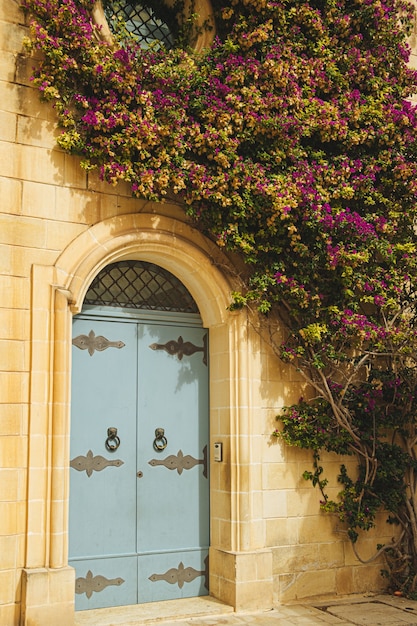
You are a GUI agent. You are given a task and a screenshot of the screen. Output one action in this format:
    pyautogui.click(x=<x>, y=<y>)
    Task: Click on the right of doorway arch
    
    Given the screenshot: What is the action you would take?
    pyautogui.click(x=240, y=423)